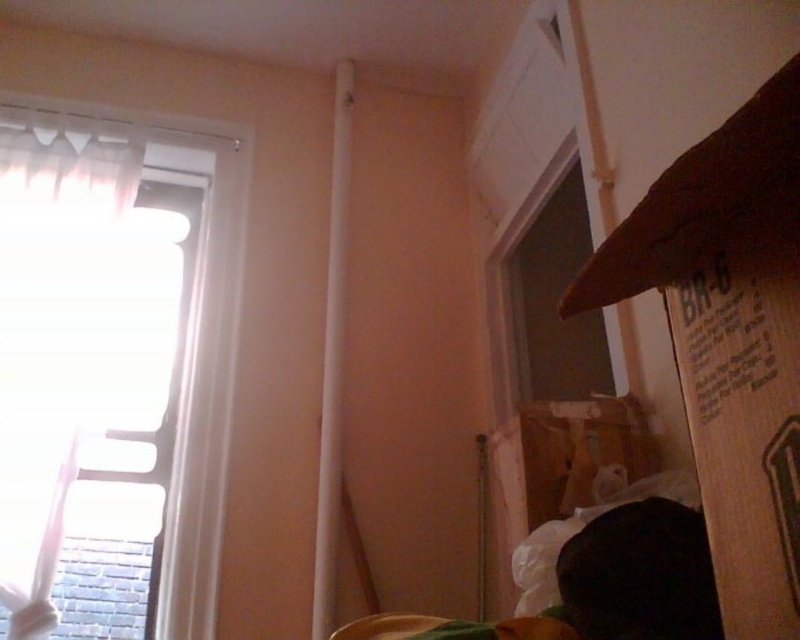
Can you confirm if brown cardboard box at right is thinner than brown cardboard box at lower right?

Yes, brown cardboard box at right is thinner than brown cardboard box at lower right.

At what (x,y) coordinates should I click in order to perform the action: click on brown cardboard box at right. Please return your answer as a coordinate pair (x, y). Looking at the image, I should click on (729, 337).

Can you confirm if white sheer curtain at left is bigger than brown cardboard box at lower right?

Yes.

Who is positioned more to the right, white sheer curtain at left or brown cardboard box at lower right?

brown cardboard box at lower right

Is point (188, 502) behind point (556, 440)?

Yes.

Where is `white sheer curtain at left`? white sheer curtain at left is located at coordinates (184, 305).

Is point (720, 458) behind point (102, 205)?

No, it is not.

Consider the image. Is brown cardboard box at right shorter than white sheer curtain at left?

Yes, brown cardboard box at right is shorter than white sheer curtain at left.

Locate an element on the screen. The height and width of the screenshot is (640, 800). brown cardboard box at right is located at coordinates (729, 337).